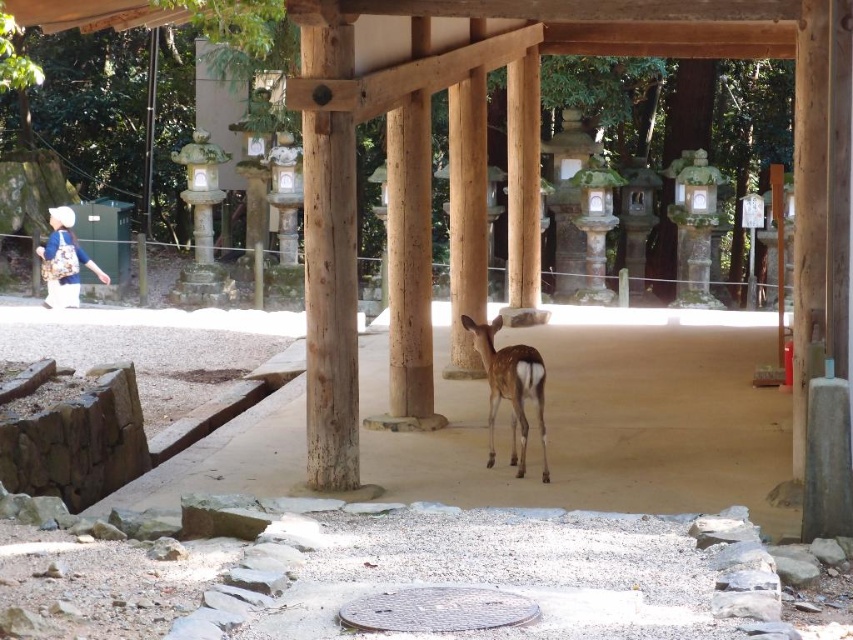
Which is below, natural wood pillar at center or brown glossy deer at center?

brown glossy deer at center is below.

Measure the distance from natural wood pillar at center to brown glossy deer at center.

natural wood pillar at center and brown glossy deer at center are 4.73 feet apart.

Is point (357, 333) more distant than point (548, 472)?

No, (357, 333) is closer to viewer.

Where is `natural wood pillar at center`? The width and height of the screenshot is (853, 640). natural wood pillar at center is located at coordinates (329, 262).

Does brown glossy deer at center appear on the right side of matte blue backpack at left?

Correct, you'll find brown glossy deer at center to the right of matte blue backpack at left.

Who is positioned more to the right, brown glossy deer at center or matte blue backpack at left?

From the viewer's perspective, brown glossy deer at center appears more on the right side.

Is point (521, 342) more distant than point (45, 298)?

No, it is in front of (45, 298).

Where is `brown glossy deer at center`? The width and height of the screenshot is (853, 640). brown glossy deer at center is located at coordinates (509, 388).

Which is behind, point (341, 301) or point (45, 248)?

Point (45, 248)

Who is lower down, natural wood pillar at center or matte blue backpack at left?

natural wood pillar at center is below.

The height and width of the screenshot is (640, 853). Find the location of `natural wood pillar at center`. natural wood pillar at center is located at coordinates (329, 262).

The width and height of the screenshot is (853, 640). I want to click on natural wood pillar at center, so click(x=329, y=262).